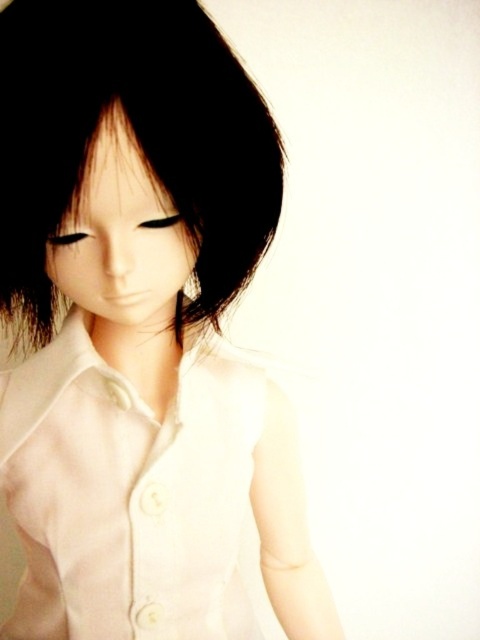
Question: From the image, what is the correct spatial relationship of matte white doll at center in relation to black matte hair at upper center?

Choices:
 (A) left
 (B) right

Answer: (A)

Question: Which of the following is the farthest from the observer?

Choices:
 (A) white matte dress shirt at center
 (B) black matte hair at upper center

Answer: (A)

Question: Is white matte dress shirt at center closer to the viewer compared to black matte hair at upper center?

Choices:
 (A) yes
 (B) no

Answer: (B)

Question: Which point appears closest to the camera in this image?

Choices:
 (A) (267, 108)
 (B) (44, 445)
 (C) (116, 518)

Answer: (A)

Question: Does matte white doll at center come behind white matte dress shirt at center?

Choices:
 (A) no
 (B) yes

Answer: (A)

Question: Which point is farther to the camera?

Choices:
 (A) white matte dress shirt at center
 (B) black matte hair at upper center

Answer: (A)